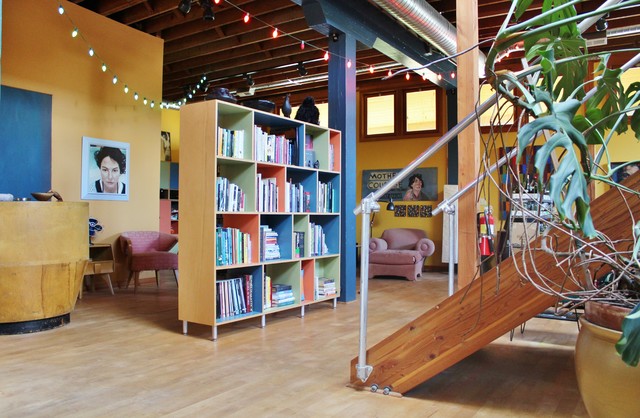
The image size is (640, 418). What are the coordinates of `exposed board ceiling` in the screenshot? It's located at (289, 12).